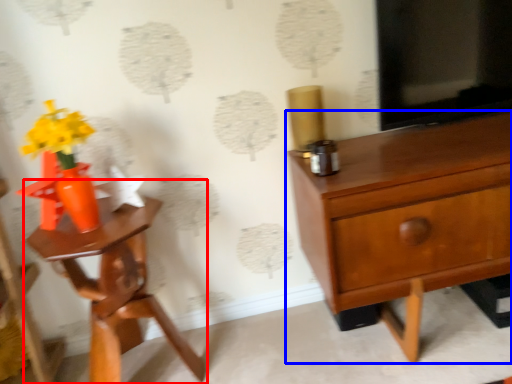
Question: Among these objects, which one is farthest to the camera, nightstand (highlighted by a red box) or chest of drawers (highlighted by a blue box)?

Choices:
 (A) nightstand
 (B) chest of drawers

Answer: (B)